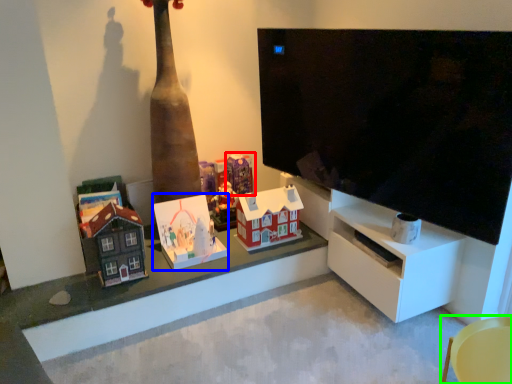
Question: Estimate the real-world distances between objects in this image. Which object is closer to toy (highlighted by a red box), toy (highlighted by a blue box) or furniture (highlighted by a green box)?

Choices:
 (A) toy
 (B) furniture

Answer: (A)